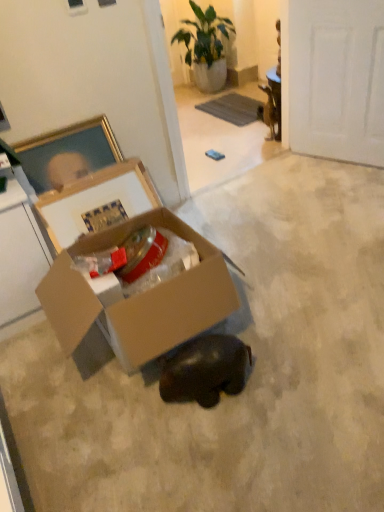
You are a GUI agent. You are given a task and a screenshot of the screen. Output one action in this format:
    pyautogui.click(x=<x>, y=<y>)
    Task: Click on the vacant region to the right of cardboard box at center
    The height and width of the screenshot is (512, 384).
    Given the screenshot: What is the action you would take?
    pyautogui.click(x=302, y=301)